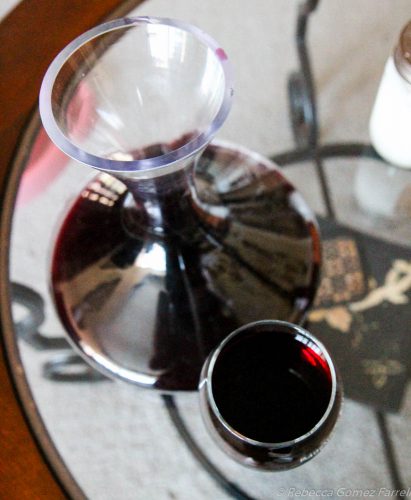
Image resolution: width=411 pixels, height=500 pixels. I want to click on platter, so click(274, 122).